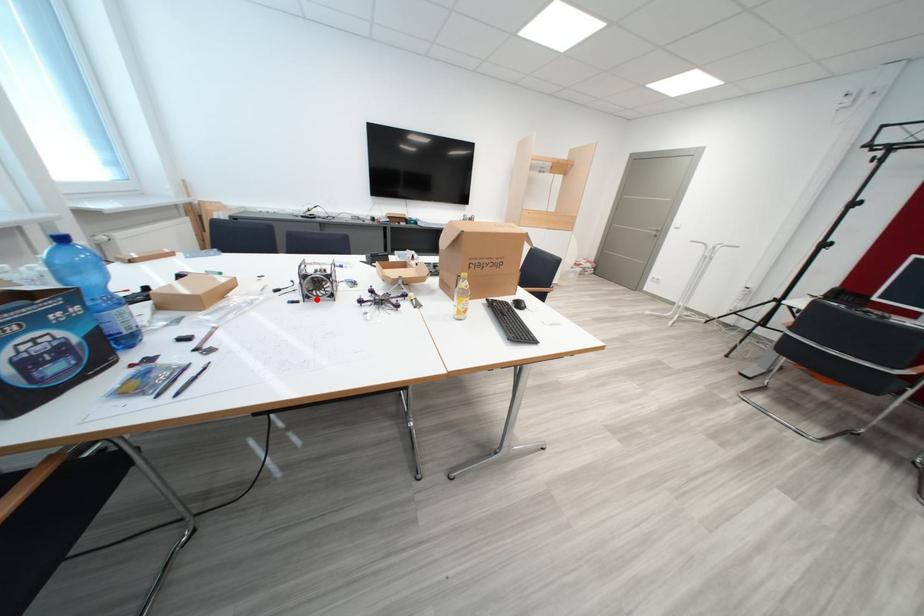
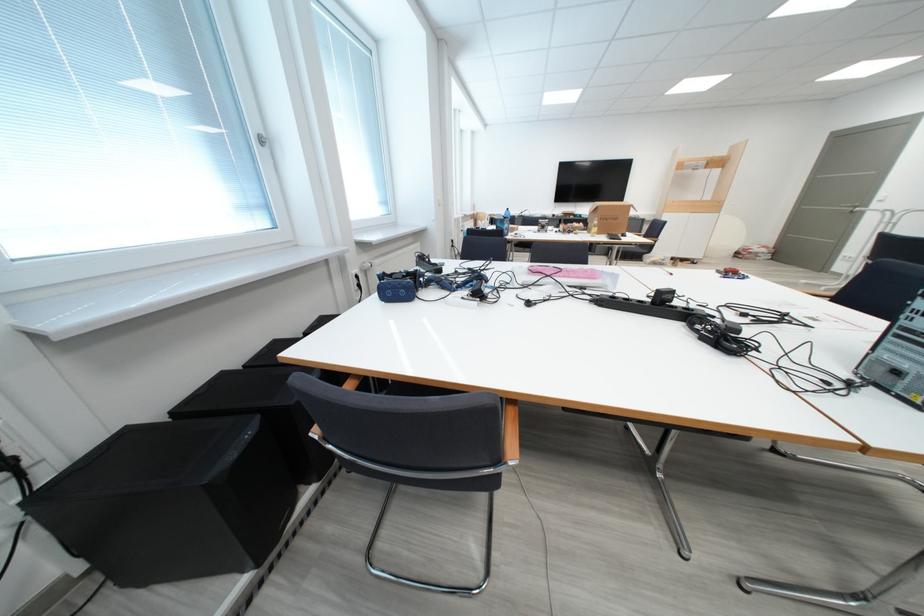
Question: I am providing you with two images of the same scene from different viewpoints. A red point is marked on the first image. Is the red point's position out of view in image 2?

Choices:
 (A) Yes
 (B) No

Answer: (A)